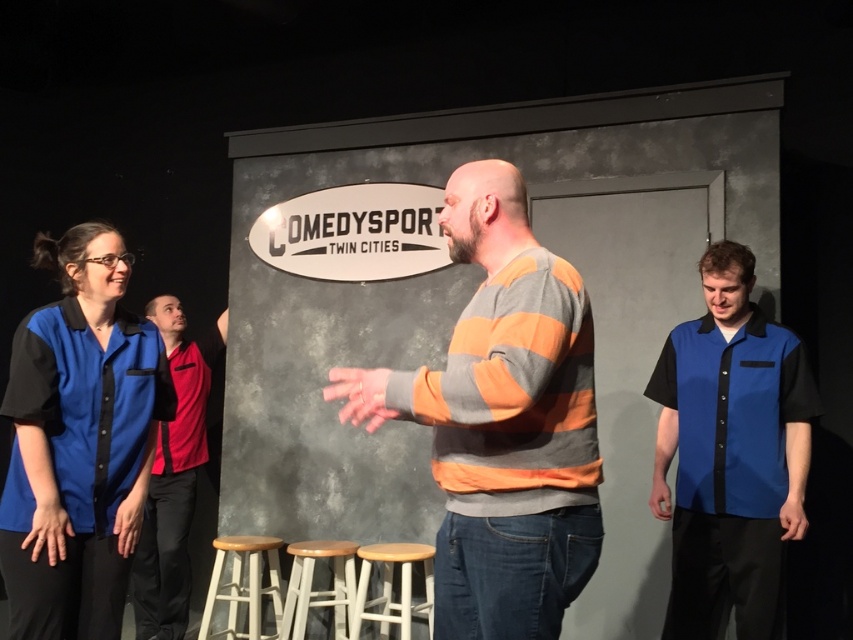
Question: Does striped sweater at center appear over red fabric shirt at left?

Choices:
 (A) yes
 (B) no

Answer: (A)

Question: Can you confirm if blue cotton shirt at left is bigger than white wood bar stool at lower center?

Choices:
 (A) yes
 (B) no

Answer: (A)

Question: Is striped sweater at center above red fabric shirt at left?

Choices:
 (A) no
 (B) yes

Answer: (B)

Question: Which of these objects is positioned farthest from the blue cotton shirt at left?

Choices:
 (A) white wood bar stool at lower center
 (B) blue cotton shirt at right
 (C) striped sweater at center

Answer: (B)

Question: Which point is closer to the camera?

Choices:
 (A) wooden seat at center
 (B) wooden bar stool at center
 (C) striped sweater at center
 (D) blue cotton shirt at right

Answer: (C)

Question: Which point is farther to the camera?

Choices:
 (A) (299, 636)
 (B) (505, 332)
 (C) (231, 561)
 (D) (171, 372)

Answer: (C)